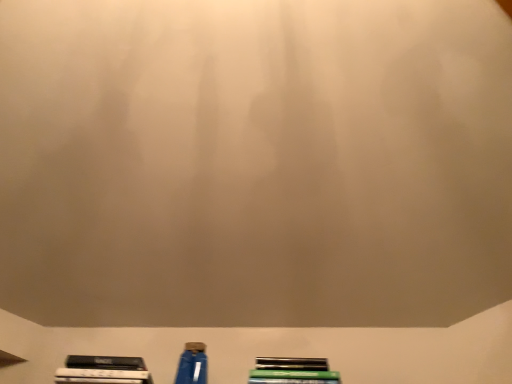
Question: Relative to blue plastic bottle at lower center, is metallic green book at lower center in front or behind?

Choices:
 (A) behind
 (B) front

Answer: (B)

Question: From their relative heights in the image, would you say metallic green book at lower center is taller or shorter than blue plastic bottle at lower center?

Choices:
 (A) tall
 (B) short

Answer: (B)

Question: Is point (263, 370) positioned closer to the camera than point (203, 370)?

Choices:
 (A) closer
 (B) farther

Answer: (B)

Question: Choose the correct answer: Is blue plastic bottle at lower center inside metallic green book at lower center or outside it?

Choices:
 (A) inside
 (B) outside

Answer: (B)

Question: From their relative heights in the image, would you say blue plastic bottle at lower center is taller or shorter than metallic green book at lower center?

Choices:
 (A) short
 (B) tall

Answer: (B)

Question: From the image's perspective, is blue plastic bottle at lower center above or below metallic green book at lower center?

Choices:
 (A) below
 (B) above

Answer: (B)

Question: Considering the positions of blue plastic bottle at lower center and metallic green book at lower center in the image, is blue plastic bottle at lower center wider or thinner than metallic green book at lower center?

Choices:
 (A) thin
 (B) wide

Answer: (A)